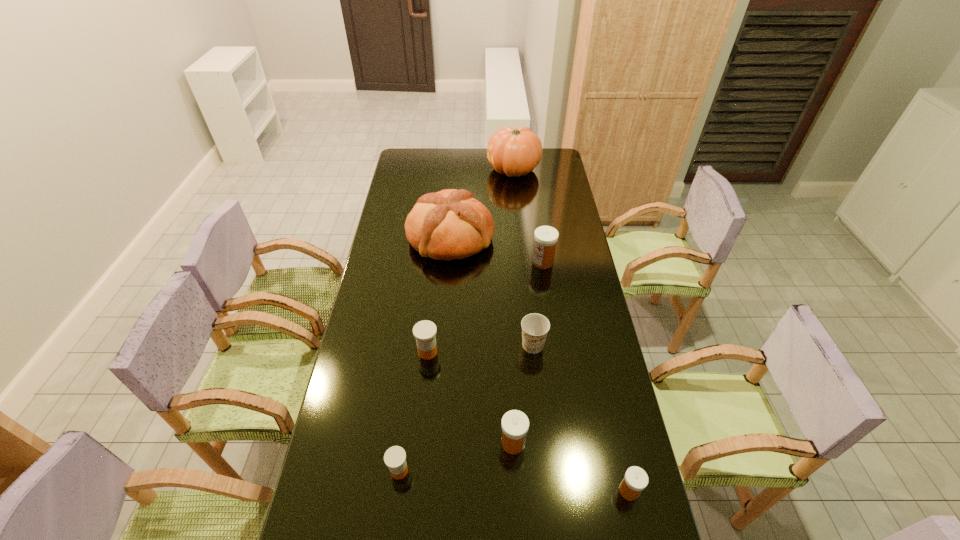
Identify which object is the seventh closest to the third nearest medicine. Please provide its 2D coordinates. Your answer should be formatted as a tuple, i.e. [(x, y)], where the tuple contains the x and y coordinates of a point satisfying the conditions above.

[(515, 152)]

Find the location of a particular element. medicine identified as the second closest to the orange Dixie cup is located at coordinates (424, 331).

Select which medicine is the fourth closest to the second farthest medicine. Please provide its 2D coordinates. Your answer should be formatted as a tuple, i.e. [(x, y)], where the tuple contains the x and y coordinates of a point satisfying the conditions above.

[(635, 480)]

Point out which white medicine is positioned as the second nearest to the farthest object. Please provide its 2D coordinates. Your answer should be formatted as a tuple, i.e. [(x, y)], where the tuple contains the x and y coordinates of a point satisfying the conditions above.

[(515, 424)]

This screenshot has height=540, width=960. In order to click on the closest white medicine to the farthest object in this screenshot , I will do `click(546, 237)`.

Where is `vacant space that satisfies the following two spatial constraints: 1. on the front side of the nearest white medicine; 2. on the right side of the bread`? The image size is (960, 540). vacant space that satisfies the following two spatial constraints: 1. on the front side of the nearest white medicine; 2. on the right side of the bread is located at coordinates (432, 491).

Image resolution: width=960 pixels, height=540 pixels. Find the location of `free point that satisfies the following two spatial constraints: 1. on the label of the bigger orange medicine; 2. on the right side of the rightmost object`. free point that satisfies the following two spatial constraints: 1. on the label of the bigger orange medicine; 2. on the right side of the rightmost object is located at coordinates (414, 491).

At what (x,y) coordinates should I click in order to perform the action: click on free space that satisfies the following two spatial constraints: 1. on the label of the farther orange medicine; 2. on the right side of the third farthest medicine. Please return your answer as a coordinate pair (x, y). The image size is (960, 540). Looking at the image, I should click on coord(419,443).